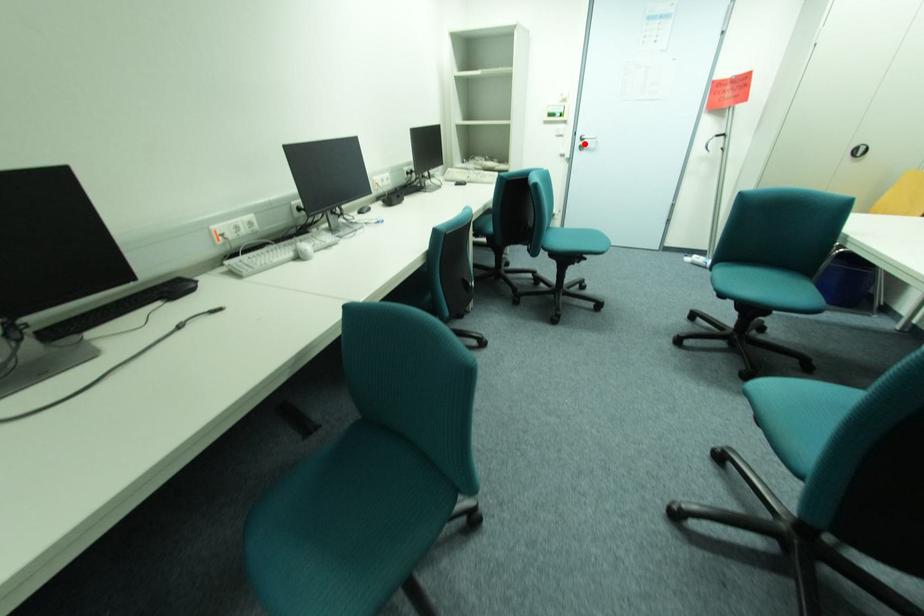
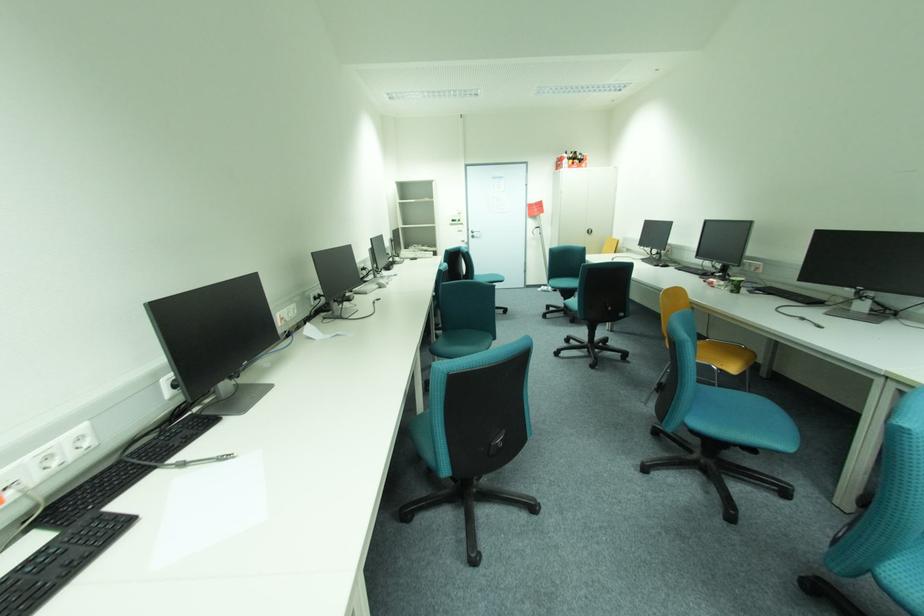
Question: I am providing you with two images of the same scene from different viewpoints. In image1, a red point is highlighted. Considering the same 3D point in image2, which of the following is correct?

Choices:
 (A) It is closer
 (B) It is farther

Answer: (B)